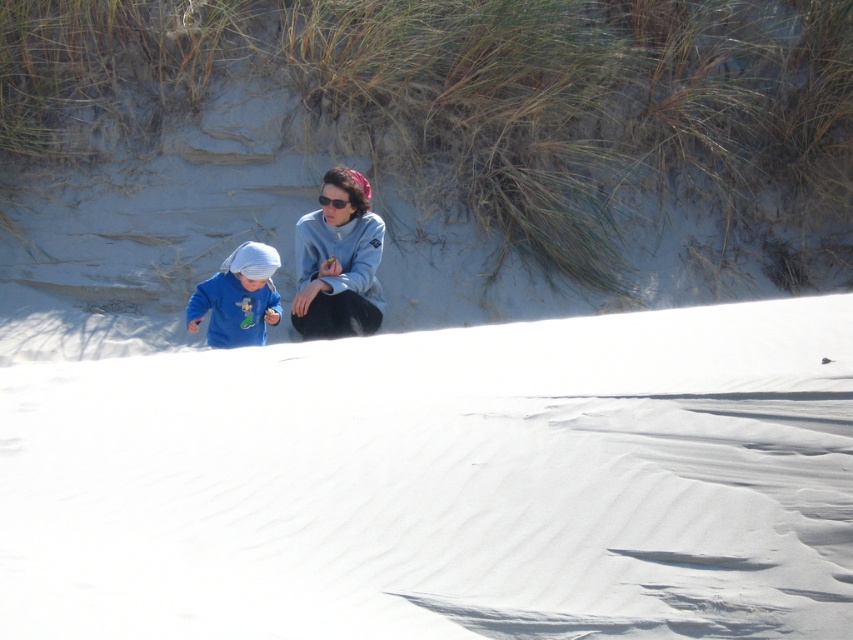
Is white powdery snow at center below matte blue shirt at lower left?

Indeed, white powdery snow at center is positioned under matte blue shirt at lower left.

Does point (767, 440) come farther from viewer compared to point (244, 300)?

That is False.

Between point (421, 513) and point (209, 280), which one is positioned in front?

Point (421, 513) is in front.

Locate an element on the screen. white powdery snow at center is located at coordinates (442, 483).

Locate an element on the screen. matte blue shirt at lower left is located at coordinates (238, 298).

In the scene shown: Does matte blue shirt at lower left appear on the right side of black plastic sunglasses at center?

In fact, matte blue shirt at lower left is to the left of black plastic sunglasses at center.

Describe the element at coordinates (238, 298) in the screenshot. Image resolution: width=853 pixels, height=640 pixels. I see `matte blue shirt at lower left` at that location.

Find the location of a particular element. Image resolution: width=853 pixels, height=640 pixels. matte blue shirt at lower left is located at coordinates (238, 298).

Is smooth sand dune at center bigger than black plastic sunglasses at center?

Indeed, smooth sand dune at center has a larger size compared to black plastic sunglasses at center.

Between smooth sand dune at center and black plastic sunglasses at center, which one is positioned lower?

Positioned lower is smooth sand dune at center.

Find the location of a particular element. smooth sand dune at center is located at coordinates (419, 152).

Image resolution: width=853 pixels, height=640 pixels. I want to click on smooth sand dune at center, so click(x=419, y=152).